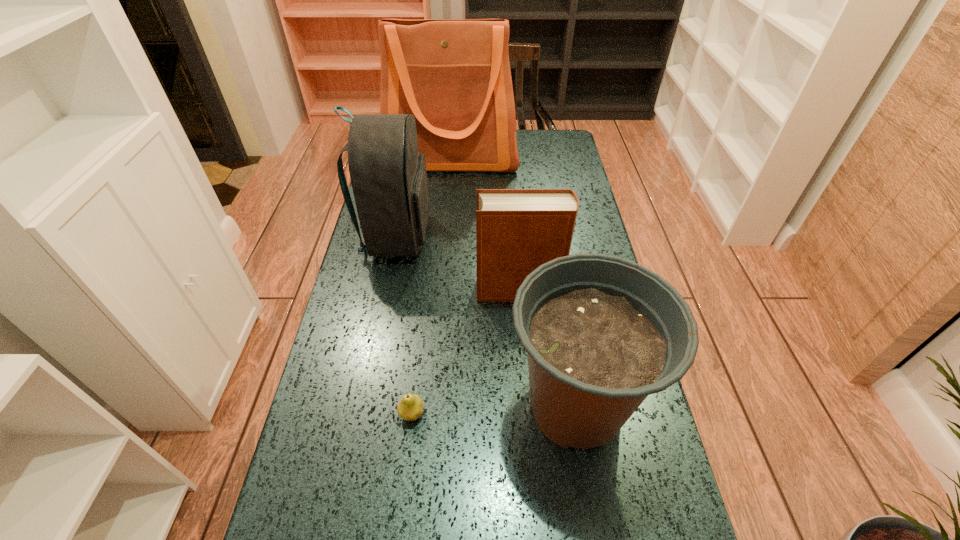
The width and height of the screenshot is (960, 540). I want to click on free space between the pear and the backpack, so click(x=404, y=325).

Find the location of a particular element. This screenshot has width=960, height=540. the second closest object to the fourth nearest object is located at coordinates (453, 75).

Image resolution: width=960 pixels, height=540 pixels. In order to click on object that ranks as the fourth closest to the pear in this screenshot , I will do [453, 75].

Where is `vacant space that satisfies the following two spatial constraints: 1. on the front-facing side of the backpack; 2. on the left side of the flowerpot`? Image resolution: width=960 pixels, height=540 pixels. vacant space that satisfies the following two spatial constraints: 1. on the front-facing side of the backpack; 2. on the left side of the flowerpot is located at coordinates (363, 406).

Where is `free space that satisfies the following two spatial constraints: 1. on the open cover of the flowerpot; 2. on the left side of the hardback book`? Image resolution: width=960 pixels, height=540 pixels. free space that satisfies the following two spatial constraints: 1. on the open cover of the flowerpot; 2. on the left side of the hardback book is located at coordinates (529, 406).

This screenshot has width=960, height=540. What are the coordinates of `free point that satisfies the following two spatial constraints: 1. on the front-facing side of the backpack; 2. on the left side of the shortest object` in the screenshot? It's located at (361, 414).